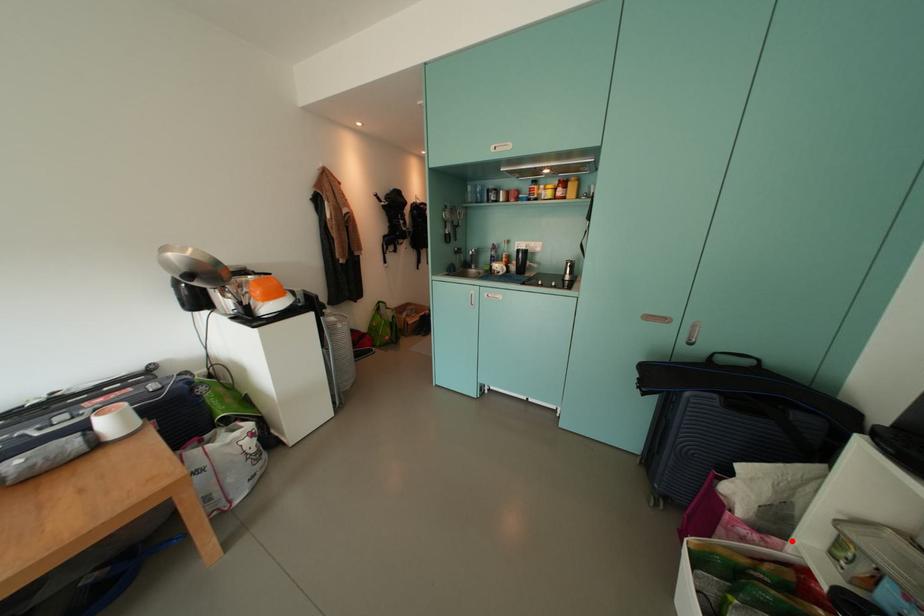
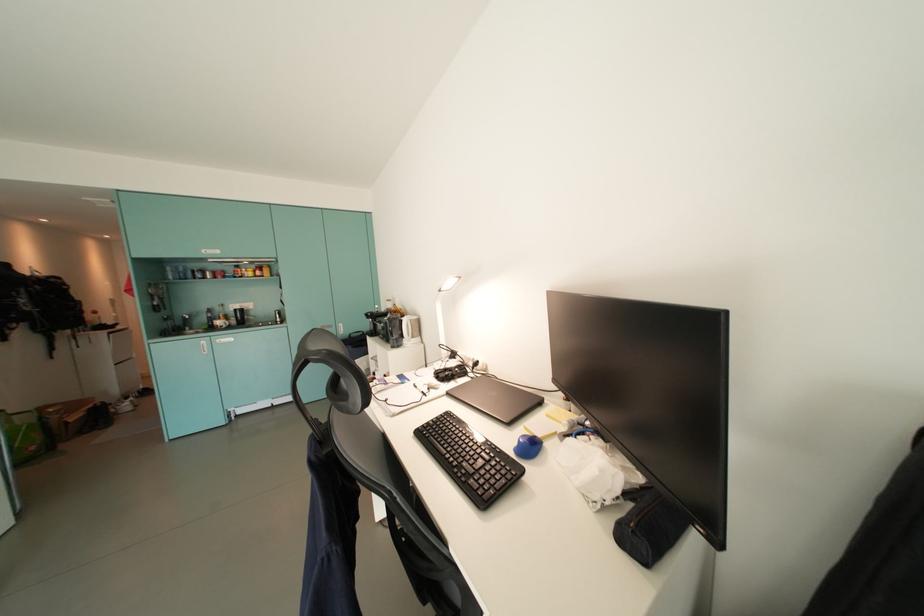
Question: I am providing you with two images of the same scene from different viewpoints. A red point is marked on the first image. At the location where the point appears in image 1, is it still visible in image 2?

Choices:
 (A) Yes
 (B) No

Answer: (B)